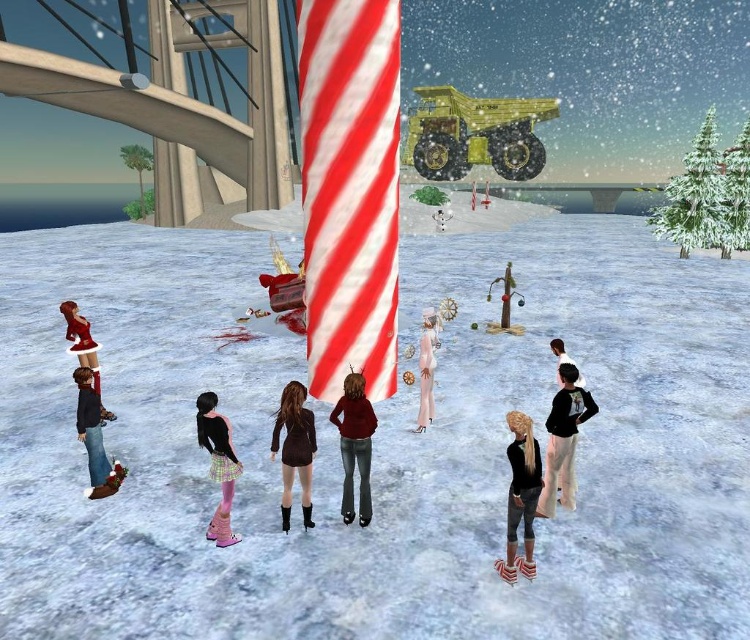
Question: Can you confirm if red and white striped fabric at center is positioned below black matte boots at lower right?

Choices:
 (A) no
 (B) yes

Answer: (A)

Question: Based on their relative distances, which object is farther from the pink satin skirt at lower center?

Choices:
 (A) red and white striped fabric at center
 (B) white fluffy dress at center

Answer: (B)

Question: Which point is farther from the camera taking this photo?

Choices:
 (A) (558, 339)
 (B) (586, 408)
 (C) (360, 436)

Answer: (A)

Question: Among these points, which one is farthest from the camera?

Choices:
 (A) (350, 516)
 (B) (423, 324)
 (C) (213, 403)
 (D) (561, 349)

Answer: (B)

Question: Is black matte boots at lower right wider than velvet red dress at left?

Choices:
 (A) yes
 (B) no

Answer: (B)

Question: Can you confirm if white textured pants at lower right is thinner than black matte boots at lower right?

Choices:
 (A) no
 (B) yes

Answer: (A)